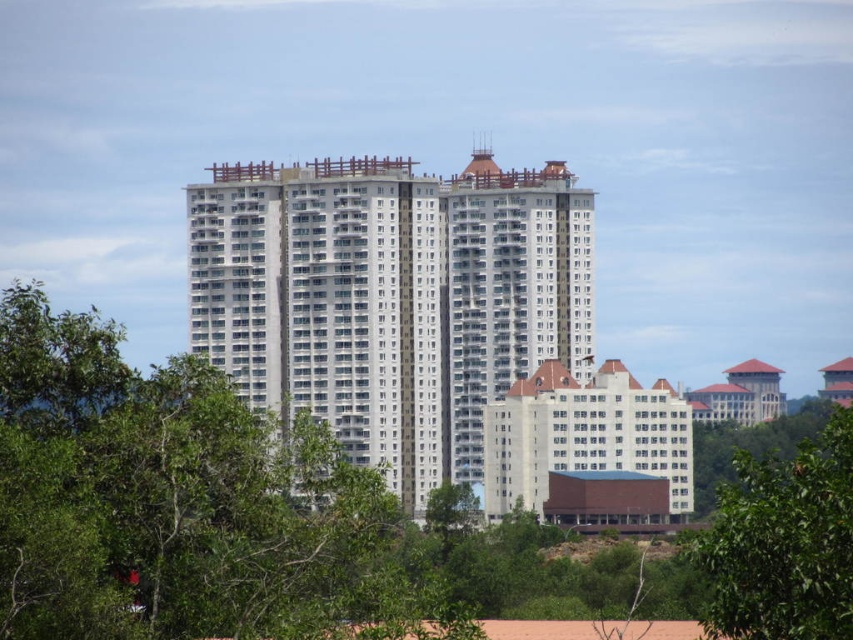
You are a drone operator tasked with capturing aerial footage of the white concrete building at center and the green leafy tree at lower right. From your current position, which object is closer to the camera?

The green leafy tree at lower right is closer to the camera because the white concrete building at center is positioned over it, indicating it is further away.

You are a drone operator trying to capture a clear aerial shot of both the green leafy tree at center and the green leafy tree at lower right. However, you notice that one tree is blocking the view of the other. Which tree is blocking the other one?

The green leafy tree at lower right is behind the green leafy tree at center, so the green leafy tree at center is blocking the view of the green leafy tree at lower right.